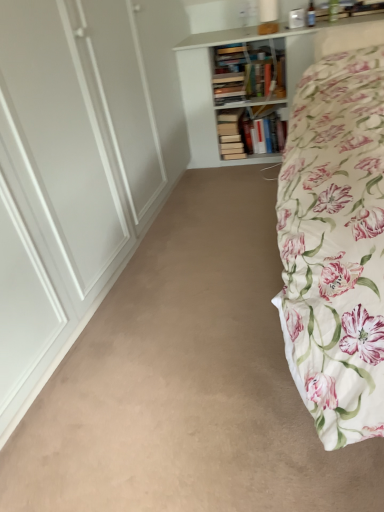
Question: Is white wooden bookcase at upper center at the back of beige carpet at center?

Choices:
 (A) yes
 (B) no

Answer: (B)

Question: Is beige carpet at center with white wooden bookcase at upper center?

Choices:
 (A) yes
 (B) no

Answer: (B)

Question: Is beige carpet at center at the right side of white wooden bookcase at upper center?

Choices:
 (A) yes
 (B) no

Answer: (B)

Question: Is beige carpet at center located outside white wooden bookcase at upper center?

Choices:
 (A) no
 (B) yes

Answer: (B)

Question: Can you confirm if beige carpet at center is bigger than white wooden bookcase at upper center?

Choices:
 (A) yes
 (B) no

Answer: (B)

Question: In the image, is white wooden bookcase at upper center on the left side or the right side of floral cotton bed at right?

Choices:
 (A) left
 (B) right

Answer: (A)

Question: Considering the positions of white wooden bookcase at upper center and floral cotton bed at right in the image, is white wooden bookcase at upper center wider or thinner than floral cotton bed at right?

Choices:
 (A) thin
 (B) wide

Answer: (A)

Question: In terms of height, does white wooden bookcase at upper center look taller or shorter compared to floral cotton bed at right?

Choices:
 (A) tall
 (B) short

Answer: (A)

Question: Considering the positions of white wooden bookcase at upper center and floral cotton bed at right in the image, is white wooden bookcase at upper center bigger or smaller than floral cotton bed at right?

Choices:
 (A) big
 (B) small

Answer: (B)

Question: In terms of height, does white wooden bookcase at upper center look taller or shorter compared to beige carpet at center?

Choices:
 (A) tall
 (B) short

Answer: (A)

Question: Looking at the image, does white wooden bookcase at upper center seem bigger or smaller compared to beige carpet at center?

Choices:
 (A) big
 (B) small

Answer: (A)

Question: In terms of width, does white wooden bookcase at upper center look wider or thinner when compared to beige carpet at center?

Choices:
 (A) thin
 (B) wide

Answer: (A)

Question: Does point (187, 79) appear closer or farther from the camera than point (215, 358)?

Choices:
 (A) farther
 (B) closer

Answer: (A)

Question: Relative to white wooden bookcase at upper center, is floral cotton bed at right in front or behind?

Choices:
 (A) front
 (B) behind

Answer: (A)

Question: Considering the positions of floral cotton bed at right and white wooden bookcase at upper center in the image, is floral cotton bed at right wider or thinner than white wooden bookcase at upper center?

Choices:
 (A) wide
 (B) thin

Answer: (A)